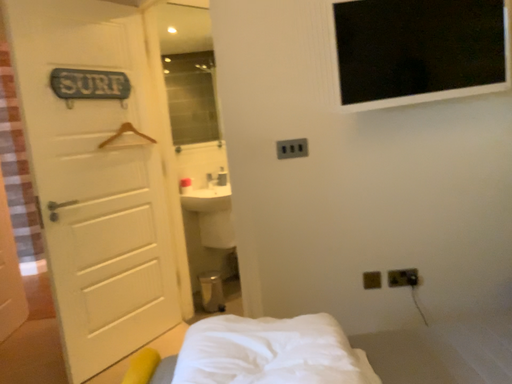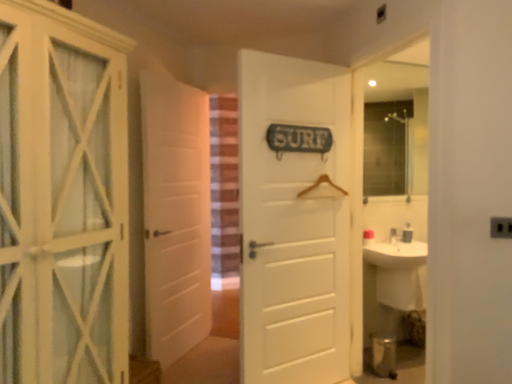
Question: Which way did the camera rotate in the video?

Choices:
 (A) rotated left
 (B) rotated right

Answer: (A)